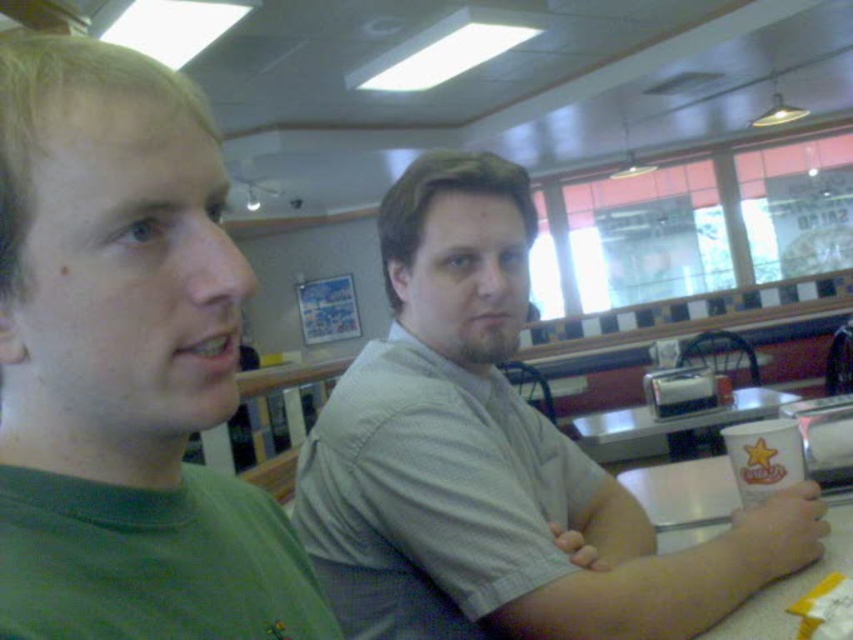
Does gray textured shirt at center lie behind white plastic table at lower right?

Yes, it is behind white plastic table at lower right.

Which is more to the right, gray textured shirt at center or white plastic table at lower right?

From the viewer's perspective, white plastic table at lower right appears more on the right side.

This screenshot has width=853, height=640. In order to click on gray textured shirt at center in this screenshot , I will do `click(492, 458)`.

Is white plastic table at lower right smaller than white paper cup at right?

Correct, white plastic table at lower right occupies less space than white paper cup at right.

At what (x,y) coordinates should I click in order to perform the action: click on white plastic table at lower right. Please return your answer as a coordinate pair (x, y). This screenshot has height=640, width=853. Looking at the image, I should click on (683, 499).

Find the location of `white plastic table at lower right`. white plastic table at lower right is located at coordinates (683, 499).

Can you confirm if green matte shirt at left is smaller than white plastic table at lower right?

Indeed, green matte shirt at left has a smaller size compared to white plastic table at lower right.

Is green matte shirt at left wider than white plastic table at lower right?

Incorrect, green matte shirt at left's width does not surpass white plastic table at lower right's.

Image resolution: width=853 pixels, height=640 pixels. Describe the element at coordinates (123, 365) in the screenshot. I see `green matte shirt at left` at that location.

Where is `green matte shirt at left`? green matte shirt at left is located at coordinates pyautogui.click(x=123, y=365).